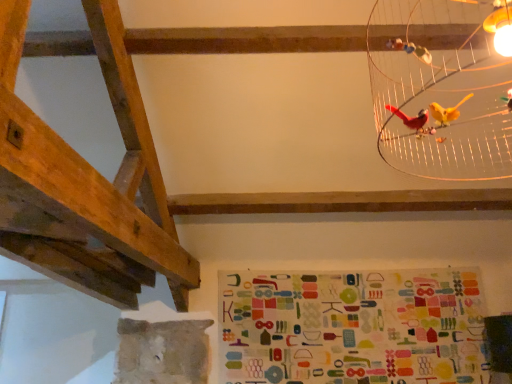
I want to click on multicolored fabric at lower right, so click(353, 327).

The image size is (512, 384). What do you see at coordinates (353, 327) in the screenshot?
I see `multicolored fabric at lower right` at bounding box center [353, 327].

Measure the distance between multicolored fabric at lower right and camera.

The depth of multicolored fabric at lower right is 2.72 meters.

Locate an element on the screen. This screenshot has width=512, height=384. multicolored fabric at lower right is located at coordinates (353, 327).